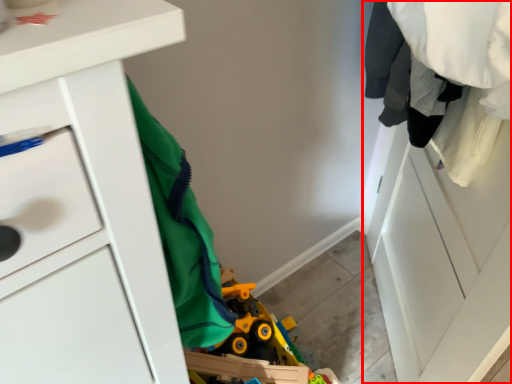
Question: Where is closet (annotated by the red box) located in relation to chest of drawers in the image?

Choices:
 (A) left
 (B) right

Answer: (B)